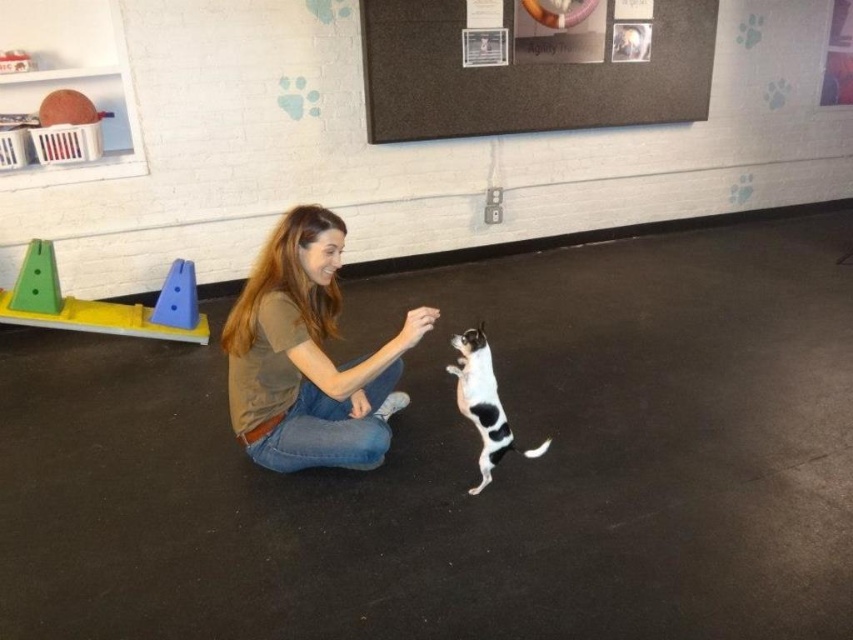
You are standing at point (309, 280) and want to move to point (712, 17). In which direction should you move?

You should move backward to reach point (712, 17) from point (309, 280) since it is behind you.

You are a service robot in the training facility. You need to move a small box from the point at point [311,449] to the woman without disturbing her interaction with the dog. The box is 2 feet wide. What is the minimum distance you should keep between the box and the woman to ensure safe passage?

The minimum safe distance should be at least 5.68 feet. Since the woman and the dog are 7.68 feet apart, subtracting the box width of 2 feet gives 7.68 minus 2 equals 5.68 feet. This ensures the box doesn not come between them.